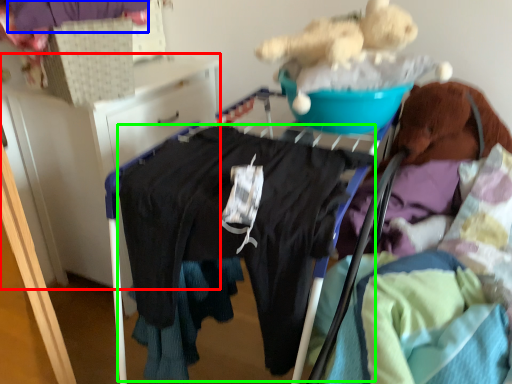
Question: Which is nearer to the furniture (highlighted by a red box)? clothing (highlighted by a blue box) or clothing (highlighted by a green box).

Choices:
 (A) clothing
 (B) clothing

Answer: (A)